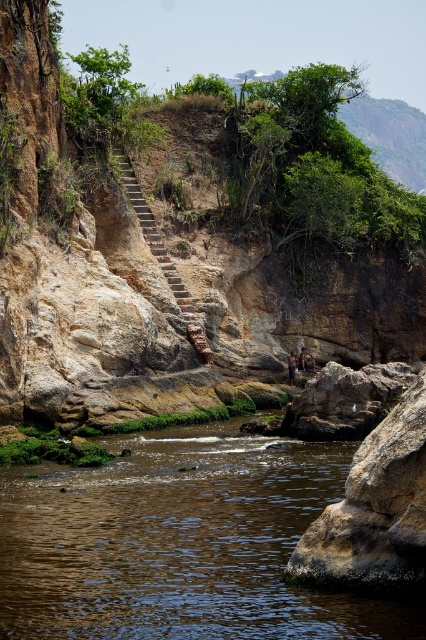
Is brown leather jacket at center to the left of tan skin person at center from the viewer's perspective?

Incorrect, brown leather jacket at center is not on the left side of tan skin person at center.

Between brown leather jacket at center and tan skin person at center, which one appears on the left side from the viewer's perspective?

tan skin person at center

The width and height of the screenshot is (426, 640). Describe the element at coordinates (305, 360) in the screenshot. I see `brown leather jacket at center` at that location.

I want to click on brown leather jacket at center, so click(x=305, y=360).

Is rustic stone stairs at upper center smaller than tan skin person at center?

Incorrect, rustic stone stairs at upper center is not smaller in size than tan skin person at center.

Which is in front, point (195, 323) or point (290, 381)?

Point (195, 323) is more forward.

Between point (150, 212) and point (291, 355), which one is positioned in front?

Point (150, 212) is in front.

You are a GUI agent. You are given a task and a screenshot of the screen. Output one action in this format:
    pyautogui.click(x=<x>, y=<y>)
    Task: Click on the rustic stone stairs at upper center
    The image size is (426, 640).
    Given the screenshot: What is the action you would take?
    pyautogui.click(x=161, y=256)

Does brown rocky hillside at center have a larger size compared to brown leather jacket at center?

Correct, brown rocky hillside at center is larger in size than brown leather jacket at center.

Can you confirm if brown rocky hillside at center is positioned to the right of brown leather jacket at center?

Incorrect, brown rocky hillside at center is not on the right side of brown leather jacket at center.

Who is more distant from viewer, [199,312] or [302,365]?

Positioned behind is point [302,365].

You are a GUI agent. You are given a task and a screenshot of the screen. Output one action in this format:
    pyautogui.click(x=<x>, y=<y>)
    Task: Click on the brown rocky hillside at center
    
    Given the screenshot: What is the action you would take?
    190,243